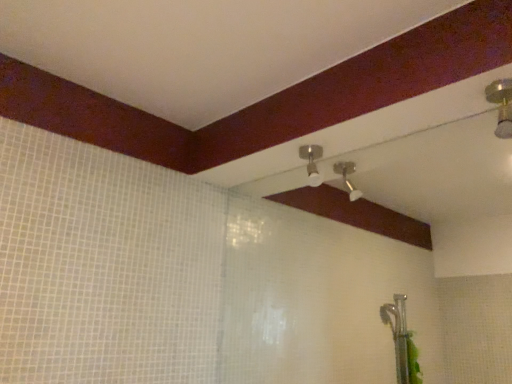
Question: In the image, is matte silver shower head at center, acting as the second shower starting from the right, positioned in front of or behind gold metallic shower head at upper right, placed as the first shower when sorted from front to back?

Choices:
 (A) front
 (B) behind

Answer: (B)

Question: Looking at their shapes, would you say matte silver shower head at center, which ranks as the first shower in left-to-right order, is wider or thinner than gold metallic shower head at upper right, the 1th shower in the right-to-left sequence?

Choices:
 (A) wide
 (B) thin

Answer: (A)

Question: Is matte silver shower head at center, which is the first shower from back to front, bigger or smaller than gold metallic shower head at upper right, the second shower positioned from the left?

Choices:
 (A) small
 (B) big

Answer: (B)

Question: Is point (509, 82) positioned closer to the camera than point (309, 157)?

Choices:
 (A) closer
 (B) farther

Answer: (A)

Question: From a real-world perspective, relative to matte silver shower head at center, which is the first shower from back to front, is gold metallic shower head at upper right, the 1th shower in the right-to-left sequence, vertically above or below?

Choices:
 (A) above
 (B) below

Answer: (A)

Question: From the image's perspective, is gold metallic shower head at upper right, the 1th shower in the right-to-left sequence, located above or below matte silver shower head at center, which ranks as the first shower in left-to-right order?

Choices:
 (A) below
 (B) above

Answer: (B)

Question: In terms of width, does gold metallic shower head at upper right, placed as the first shower when sorted from front to back, look wider or thinner when compared to matte silver shower head at center, acting as the second shower starting from the right?

Choices:
 (A) wide
 (B) thin

Answer: (B)